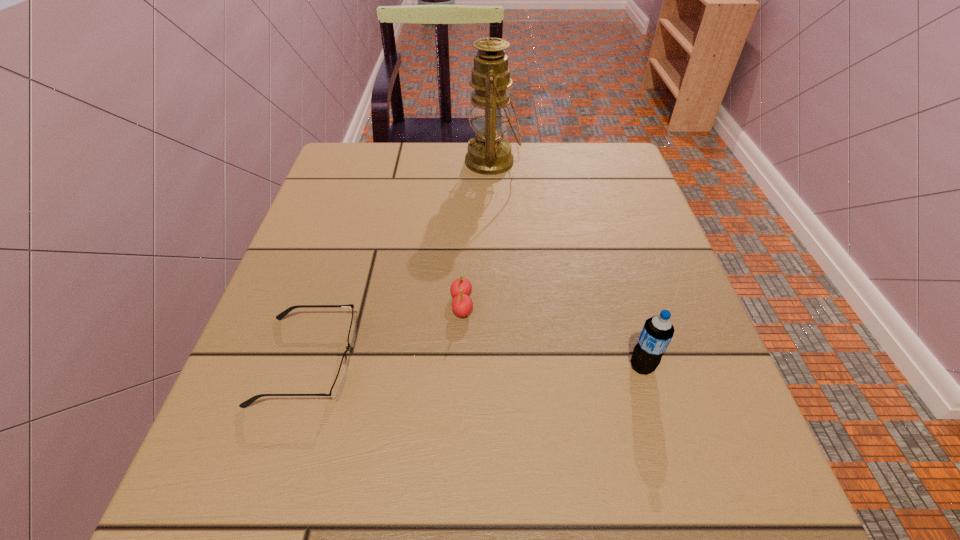
I want to click on object that is the closest one to the oil lamp, so click(462, 305).

You are a GUI agent. You are given a task and a screenshot of the screen. Output one action in this format:
    pyautogui.click(x=<x>, y=<y>)
    Task: Click on the blank space that satisfies the following two spatial constraints: 1. on the back side of the third shortest object; 2. on the front-facing side of the shortest object
    The image size is (960, 540).
    Given the screenshot: What is the action you would take?
    pyautogui.click(x=640, y=361)

Identify the location of free space that satisfies the following two spatial constraints: 1. on the back side of the soda bottle; 2. on the front-facing side of the spectacles. This screenshot has width=960, height=540. (640, 361).

Where is `free space that satisfies the following two spatial constraints: 1. on the front-facing side of the spectacles; 2. on the left side of the second tallest object`? This screenshot has height=540, width=960. free space that satisfies the following two spatial constraints: 1. on the front-facing side of the spectacles; 2. on the left side of the second tallest object is located at coordinates (305, 366).

Where is `vacant space that satisfies the following two spatial constraints: 1. on the front side of the soda bottle; 2. on the left side of the cherry`? Image resolution: width=960 pixels, height=540 pixels. vacant space that satisfies the following two spatial constraints: 1. on the front side of the soda bottle; 2. on the left side of the cherry is located at coordinates (459, 366).

At what (x,y) coordinates should I click in order to perform the action: click on vacant space that satisfies the following two spatial constraints: 1. on the front-facing side of the shortest object; 2. on the back side of the rightmost object. Please return your answer as a coordinate pair (x, y). The height and width of the screenshot is (540, 960). Looking at the image, I should click on (305, 366).

Locate an element on the screen. The image size is (960, 540). free space that satisfies the following two spatial constraints: 1. on the front-facing side of the spectacles; 2. on the left side of the third shortest object is located at coordinates (305, 366).

What are the coordinates of `vacant region that satisfies the following two spatial constraints: 1. on the back side of the cherry; 2. on the left side of the farthest object` in the screenshot? It's located at (468, 161).

At what (x,y) coordinates should I click in order to perform the action: click on vacant area in the image that satisfies the following two spatial constraints: 1. on the front-facing side of the soda bottle; 2. on the left side of the spectacles. Please return your answer as a coordinate pair (x, y). Looking at the image, I should click on (305, 366).